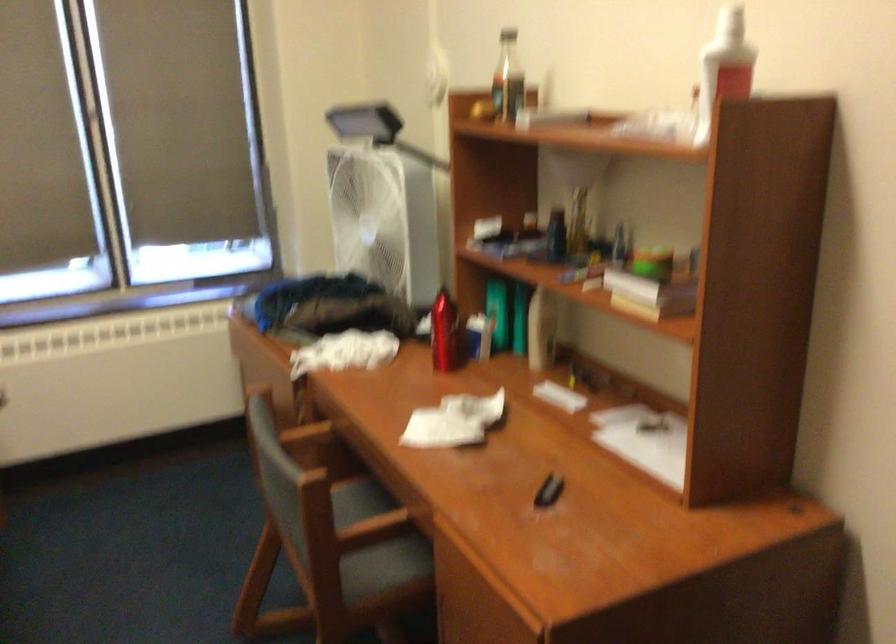
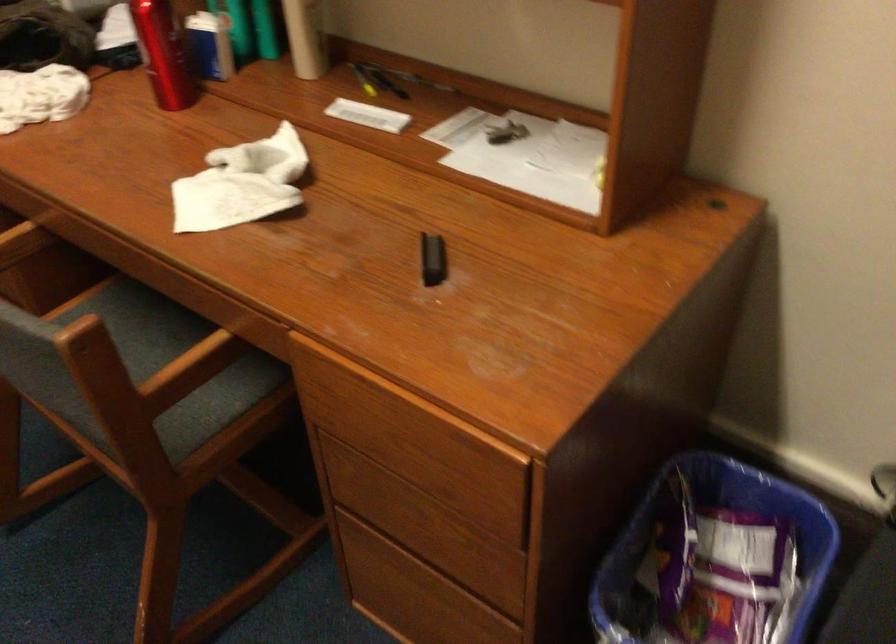
The images are taken continuously from a first-person perspective. In which direction is your viewpoint rotating?

The camera's rotation is toward right-down.